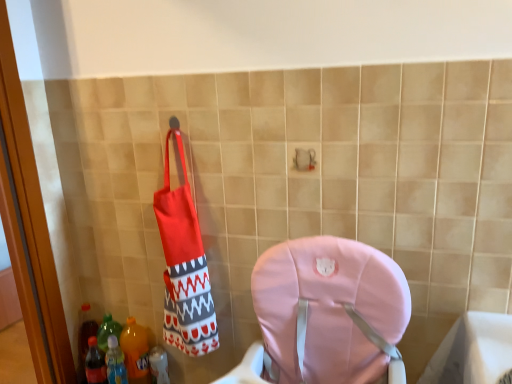
Question: Considering the relative sizes of translucent plastic bottle at lower left, the 1th bottle from the right, and translucent plastic bottle at lower left, which is the second bottle in left-to-right order, in the image provided, is translucent plastic bottle at lower left, the 1th bottle from the right, wider than translucent plastic bottle at lower left, which is the second bottle in left-to-right order,?

Choices:
 (A) no
 (B) yes

Answer: (A)

Question: Is the depth of translucent plastic bottle at lower left, the 1th bottle from the right, less than that of translucent plastic bottle at lower left, acting as the 2th bottle starting from the right?

Choices:
 (A) yes
 (B) no

Answer: (B)

Question: From the image's perspective, is translucent plastic bottle at lower left, which is the 3th bottle from left to right, over translucent plastic bottle at lower left, acting as the 2th bottle starting from the right?

Choices:
 (A) no
 (B) yes

Answer: (A)

Question: Is translucent plastic bottle at lower left, which is the 3th bottle from left to right, shorter than translucent plastic bottle at lower left, which is the second bottle in left-to-right order?

Choices:
 (A) yes
 (B) no

Answer: (A)

Question: Is there a large distance between translucent plastic bottle at lower left, which is the 3th bottle from left to right, and translucent plastic bottle at lower left, which is the second bottle in left-to-right order?

Choices:
 (A) no
 (B) yes

Answer: (A)

Question: Is translucent plastic bottle at lower left, the 1th bottle from the right, taller or shorter than translucent plastic bottle at lower left, which is the second bottle in left-to-right order?

Choices:
 (A) short
 (B) tall

Answer: (A)

Question: Considering the relative positions of translucent plastic bottle at lower left, the 1th bottle from the right, and translucent plastic bottle at lower left, which is the second bottle in left-to-right order, in the image provided, is translucent plastic bottle at lower left, the 1th bottle from the right, to the left or to the right of translucent plastic bottle at lower left, which is the second bottle in left-to-right order,?

Choices:
 (A) right
 (B) left

Answer: (A)

Question: In terms of size, does translucent plastic bottle at lower left, the 1th bottle from the right, appear bigger or smaller than translucent plastic bottle at lower left, acting as the 2th bottle starting from the right?

Choices:
 (A) small
 (B) big

Answer: (A)

Question: Is translucent plastic bottle at lower left, the 1th bottle from the right, spatially inside translucent plastic bottle at lower left, acting as the 2th bottle starting from the right, or outside of it?

Choices:
 (A) inside
 (B) outside

Answer: (B)

Question: Is translucent plastic bottle at lower left, which is the second bottle in left-to-right order, in front of or behind translucent plastic bottle at lower left, which is counted as the third bottle, starting from the right, in the image?

Choices:
 (A) front
 (B) behind

Answer: (B)

Question: Looking at the image, does translucent plastic bottle at lower left, acting as the 2th bottle starting from the right, seem bigger or smaller compared to translucent plastic bottle at lower left, which is counted as the third bottle, starting from the right?

Choices:
 (A) big
 (B) small

Answer: (A)

Question: From the image's perspective, relative to translucent plastic bottle at lower left, the first bottle positioned from the left, is translucent plastic bottle at lower left, acting as the 2th bottle starting from the right, above or below?

Choices:
 (A) below
 (B) above

Answer: (B)

Question: In terms of height, does translucent plastic bottle at lower left, which is the second bottle in left-to-right order, look taller or shorter compared to translucent plastic bottle at lower left, which is counted as the third bottle, starting from the right?

Choices:
 (A) short
 (B) tall

Answer: (B)

Question: Considering the relative positions of translucent plastic bottle at lower left, which is the second bottle in left-to-right order, and translucent plastic bottle at lower left, which is the 3th bottle from left to right, in the image provided, is translucent plastic bottle at lower left, which is the second bottle in left-to-right order, to the left or to the right of translucent plastic bottle at lower left, which is the 3th bottle from left to right,?

Choices:
 (A) left
 (B) right

Answer: (A)

Question: From the image's perspective, is translucent plastic bottle at lower left, acting as the 2th bottle starting from the right, above or below translucent plastic bottle at lower left, which is the 3th bottle from left to right?

Choices:
 (A) below
 (B) above

Answer: (B)